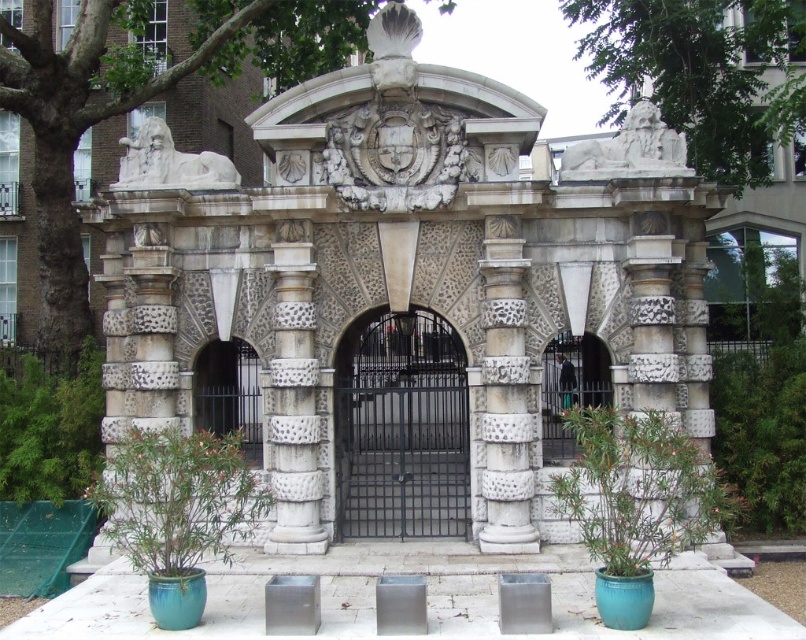
Does white textured column at center have a lesser height compared to black metal gate at center?

Yes.

Is white textured column at center above black metal gate at center?

No.

The height and width of the screenshot is (640, 806). What do you see at coordinates (505, 392) in the screenshot?
I see `white textured column at center` at bounding box center [505, 392].

The width and height of the screenshot is (806, 640). Identify the location of white textured column at center. (505, 392).

Between green leafy plant at center and white stone column at center, which one has more height?

white stone column at center is taller.

Is point (564, 481) positioned after point (667, 410)?

No, it is in front of (667, 410).

Is point (675, 474) in front of point (667, 246)?

Yes, point (675, 474) is closer to viewer.

Identify the location of green leafy plant at center. The image size is (806, 640). (638, 488).

Is black metal gate at center bigger than polished metal gate at center?

Yes.

Can you confirm if black metal gate at center is smaller than polished metal gate at center?

No, black metal gate at center is not smaller than polished metal gate at center.

Which is behind, point (214, 420) or point (559, 410)?

Positioned behind is point (214, 420).

Where is `black metal gate at center`? This screenshot has height=640, width=806. black metal gate at center is located at coordinates (229, 394).